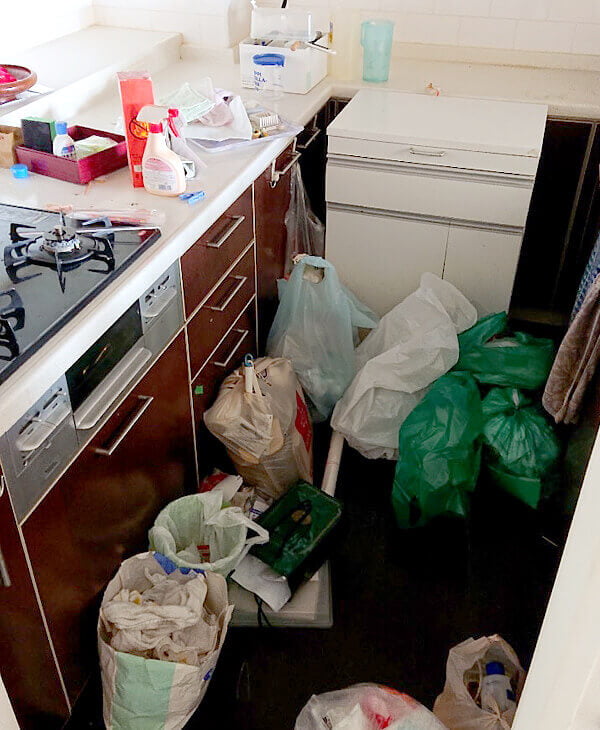
Find the location of a particular element. white spray container is located at coordinates (156, 150).